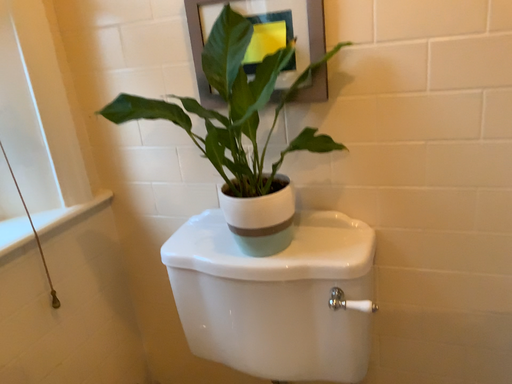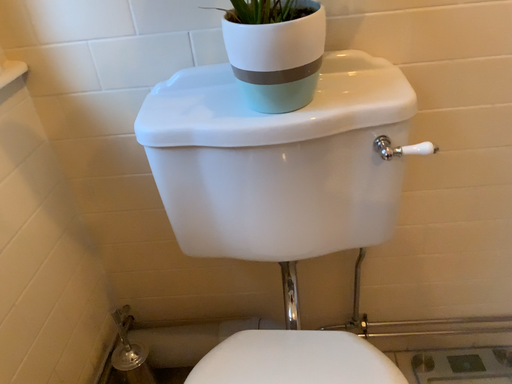
Question: How did the camera likely rotate when shooting the video?

Choices:
 (A) rotated right
 (B) rotated left

Answer: (A)